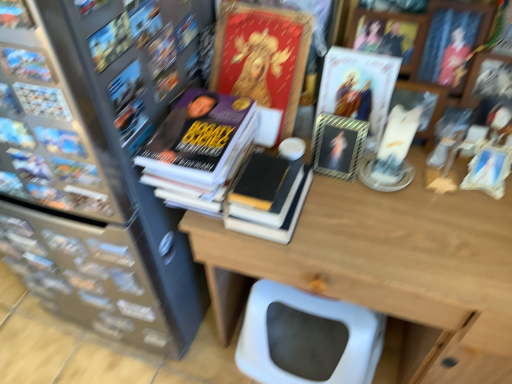
This screenshot has height=384, width=512. What are the coordinates of `free spot to the right of metallic silver frame at upper center, the 2th book cover positioned from the right` in the screenshot? It's located at (424, 203).